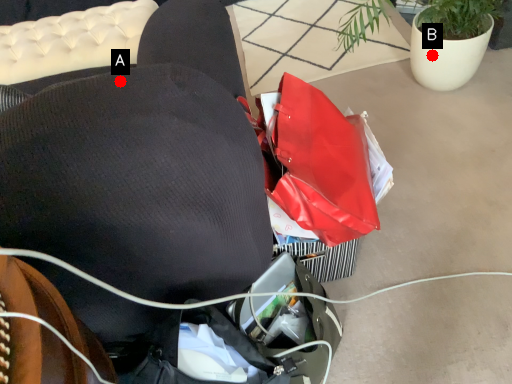
Question: Two points are circled on the image, labeled by A and B beside each circle. Which point appears farthest from the camera in this image?

Choices:
 (A) A is further
 (B) B is further

Answer: (B)